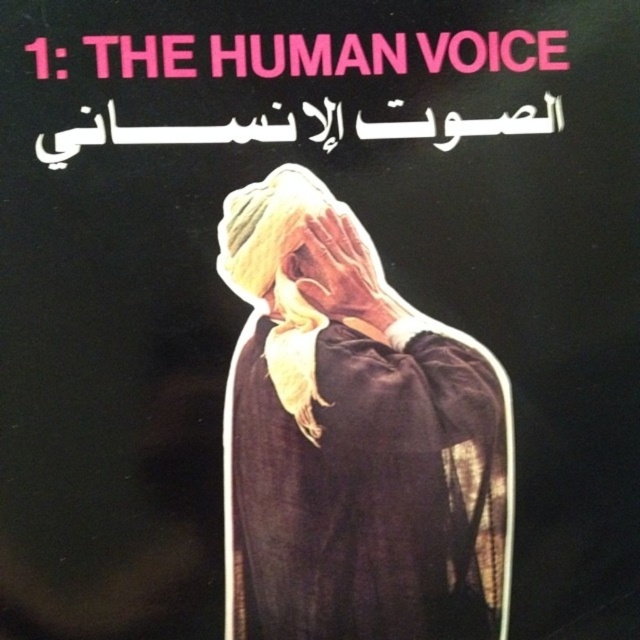
Between dark brown fabric at center and smooth skin hand at center, which one has less height?

With less height is smooth skin hand at center.

The height and width of the screenshot is (640, 640). What are the coordinates of `dark brown fabric at center` in the screenshot? It's located at (353, 438).